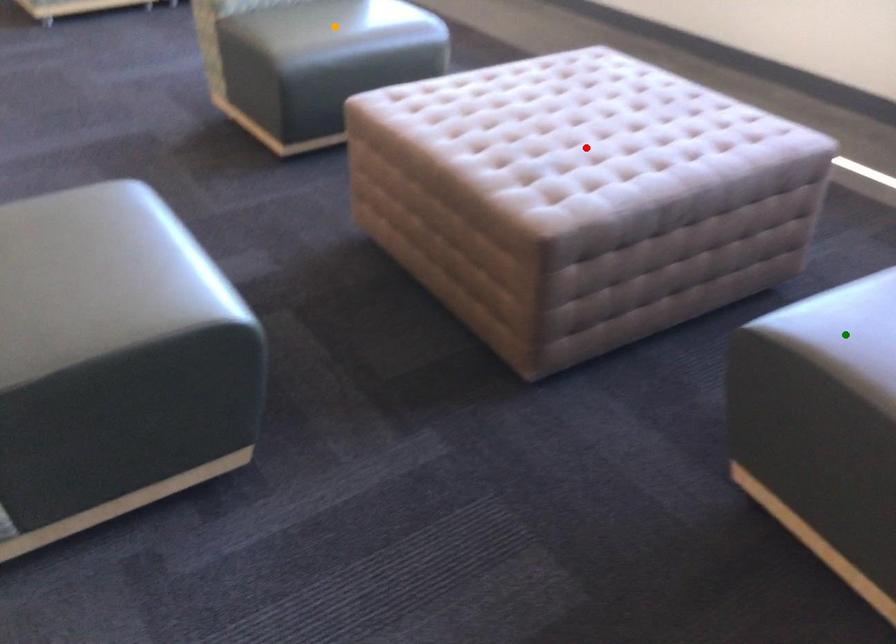
Order these from nearest to farthest:
- red point
- orange point
- green point

orange point, red point, green point